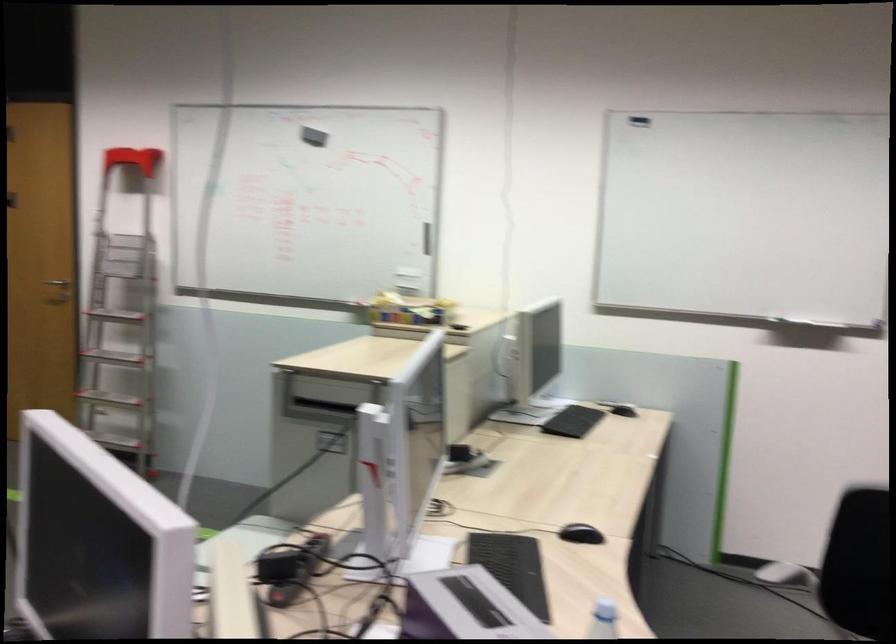
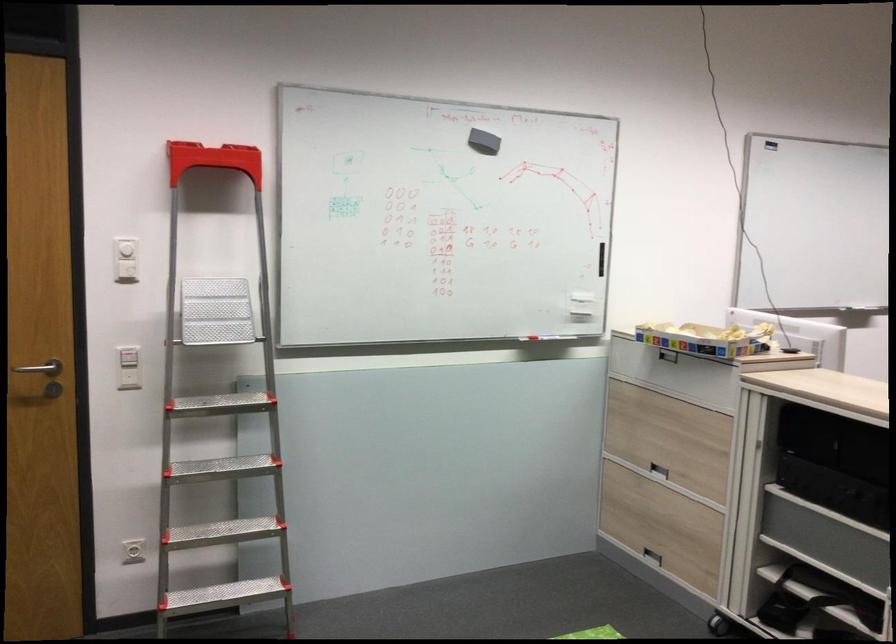
The point at (151, 205) is marked in the first image. Where is the corresponding point in the second image?

(125, 249)